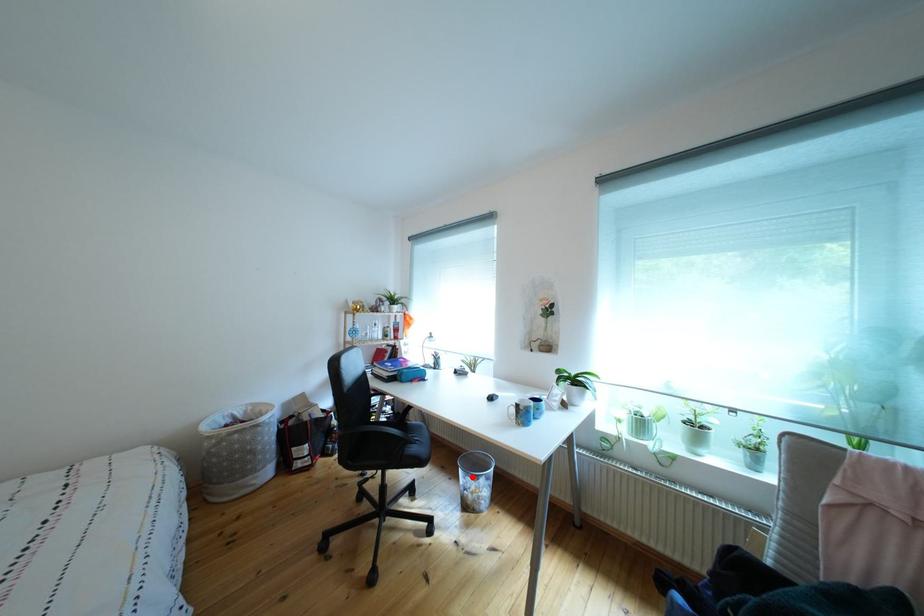
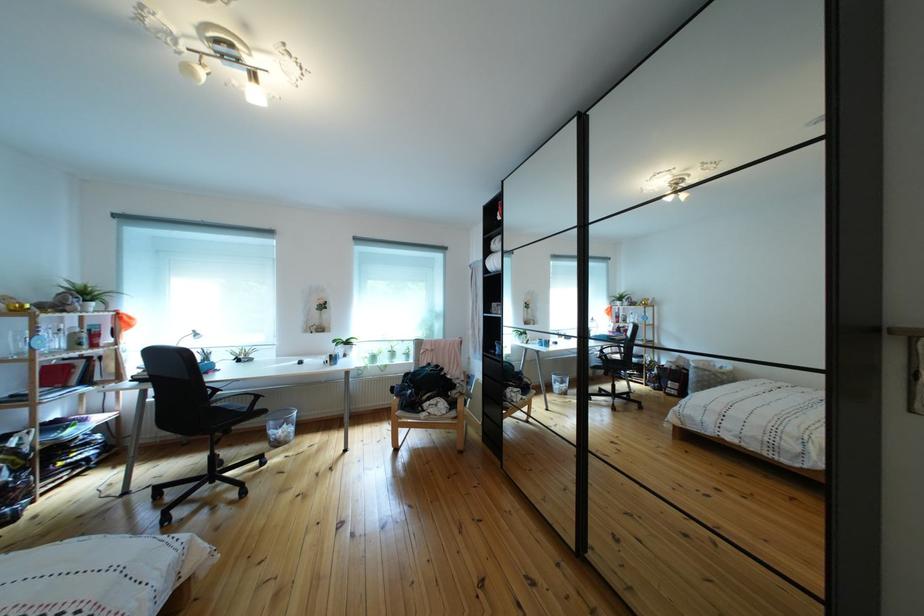
Where in the second image is the point corresponding to the highlighted location from the first image?

(283, 430)